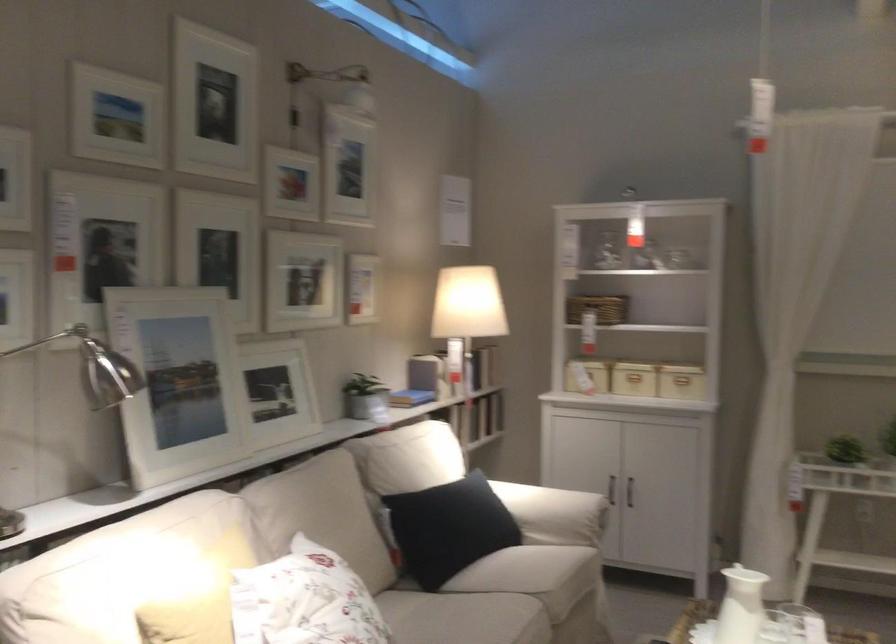
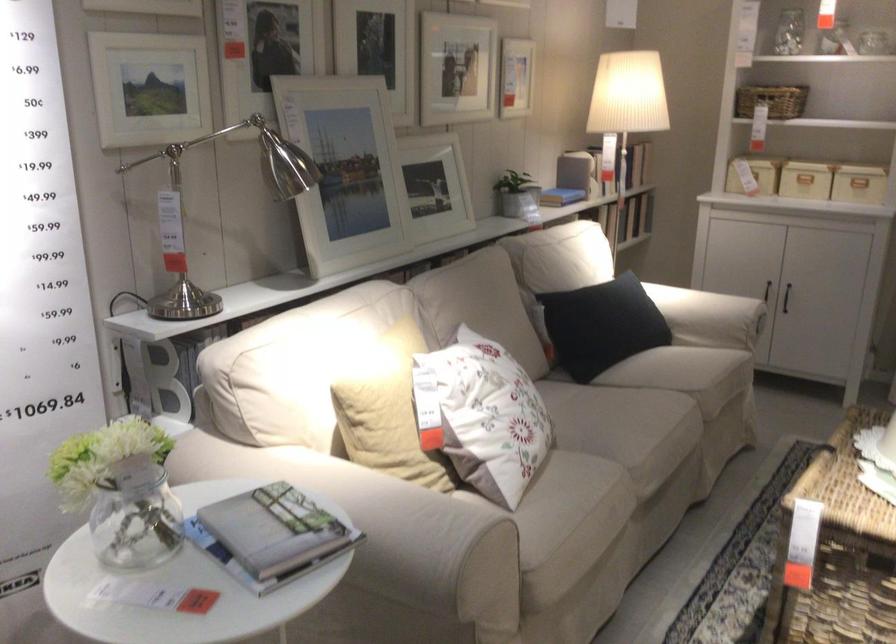
Find the pixel in the second image that matches the point at 684,393 in the first image.

(858, 184)